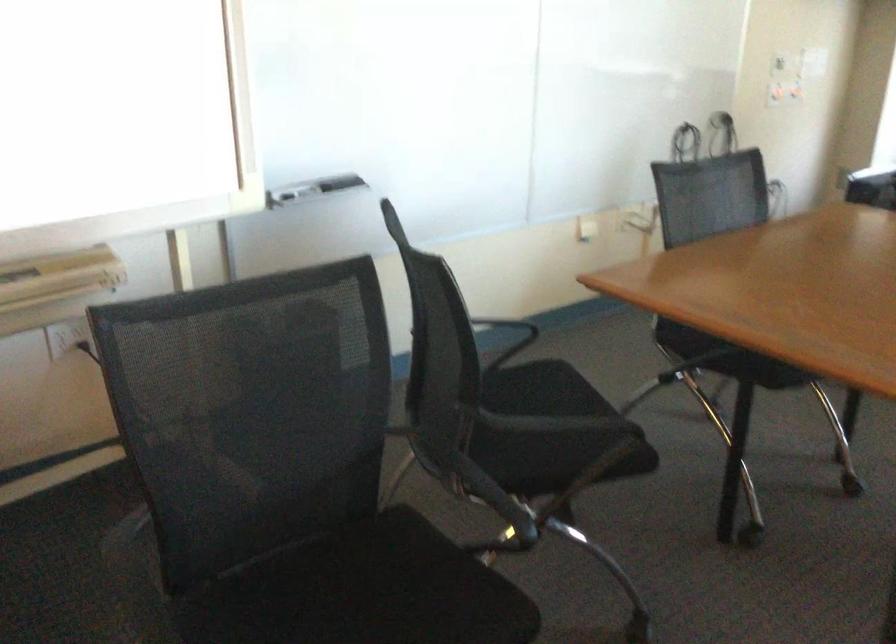
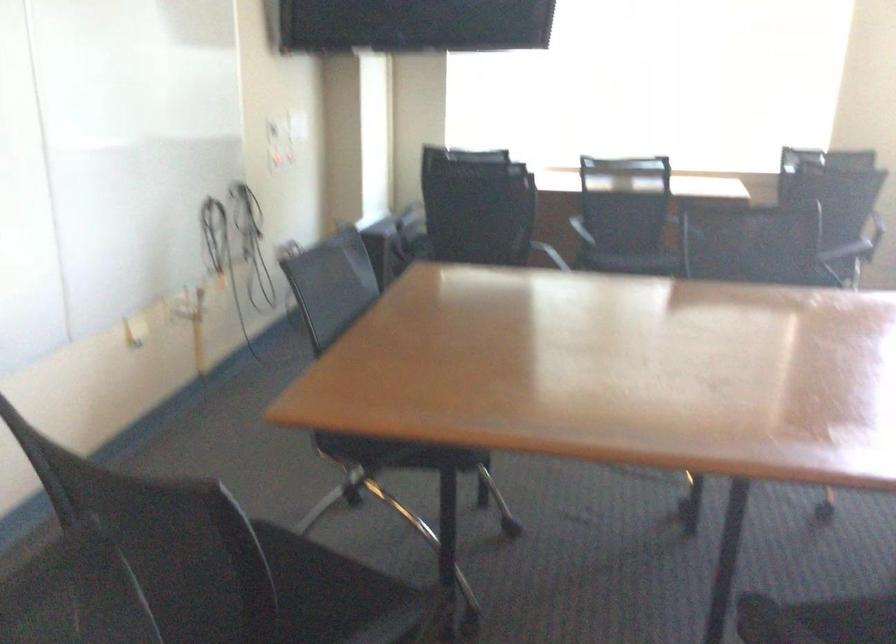
Where in the second image is the point corresponding to (721,351) from the first image?

(400, 453)